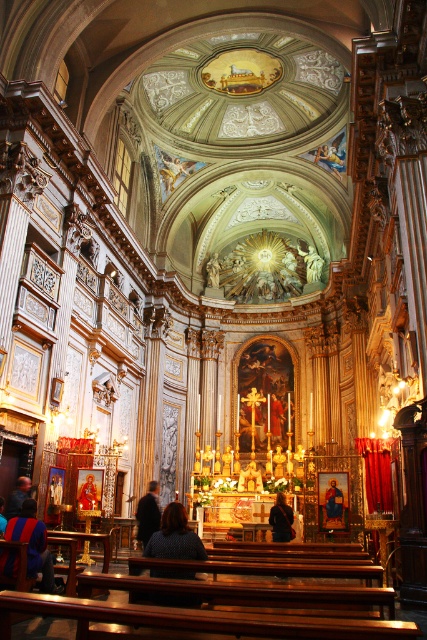
Question: Does dark brown leather coat at center have a lesser width compared to matte gold icon at center?

Choices:
 (A) yes
 (B) no

Answer: (B)

Question: Which point is closer to the camera taking this photo?

Choices:
 (A) (330, 492)
 (B) (12, 492)
 (C) (283, 497)
 (D) (142, 529)

Answer: (B)

Question: Estimate the real-world distances between objects in this image. Which object is closer to the smooth white statue at center?

Choices:
 (A) dark blue sweater at lower left
 (B) dark blue textured sweater at center
 (C) dark brown leather coat at center
 (D) matte gold icon at center

Answer: (C)

Question: Which is farther from the dark brown leather jacket at lower left?

Choices:
 (A) dark brown leather coat at center
 (B) dark brown leather jacket at center
 (C) matte gold icon at center

Answer: (C)

Question: Where is dark brown leather jacket at center located in relation to dark brown leather jacket at lower left in the image?

Choices:
 (A) right
 (B) left

Answer: (A)

Question: Is dark blue textured sweater at center positioned at the back of dark brown leather jacket at lower left?

Choices:
 (A) no
 (B) yes

Answer: (A)